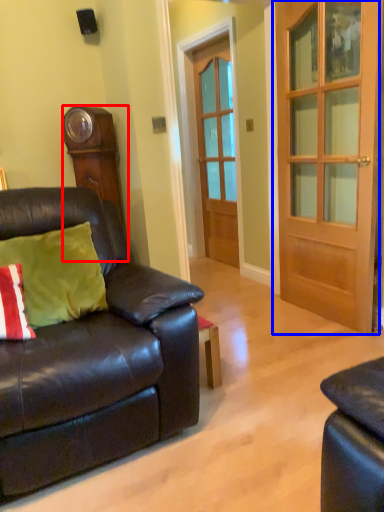
Question: Which object is closer to the camera taking this photo, cabinetry (highlighted by a red box) or door (highlighted by a blue box)?

Choices:
 (A) cabinetry
 (B) door

Answer: (B)